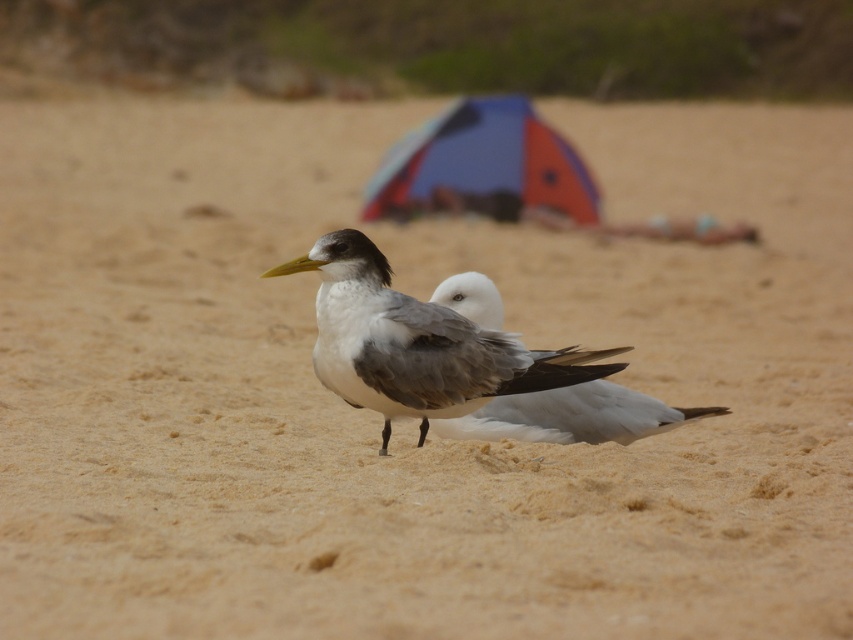
You are a photographer trying to capture both the gray matte gull at center and the blue fabric tent at center in a single frame. Based on their sizes, which object should you zoom in on to ensure both fit in the photo?

The gray matte gull at center is smaller than the blue fabric tent at center. To ensure both fit in the photo, you should zoom out slightly to accommodate the larger blue fabric tent at center while still capturing the smaller gray matte gull at center.

You are standing on the beach and see two birds represented by the points point (372, 268) and point (526, 173). Which bird is closer to you?

Point (372, 268) is in front of point (526, 173), so the bird at point (372, 268) is closer to you.